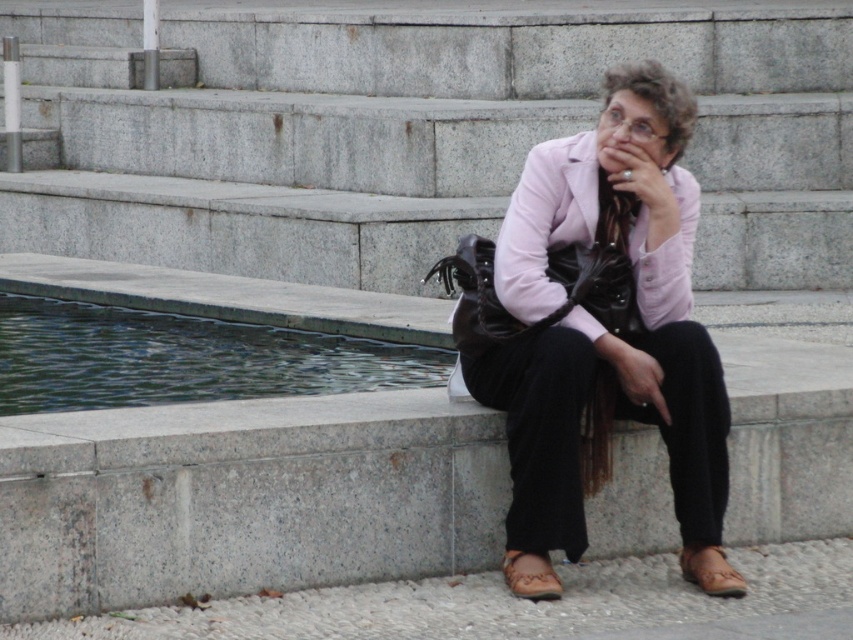
Can you confirm if green reflective water at lower left is smaller than brown leather sandal at lower right?

Incorrect, green reflective water at lower left is not smaller in size than brown leather sandal at lower right.

Describe the element at coordinates (184, 358) in the screenshot. This screenshot has height=640, width=853. I see `green reflective water at lower left` at that location.

The height and width of the screenshot is (640, 853). I want to click on green reflective water at lower left, so click(x=184, y=358).

Looking at this image, is brown leather sandal at lower right further to camera compared to brown leather sandal at lower center?

Yes, brown leather sandal at lower right is further from the viewer.

Does point (698, 548) lie behind point (547, 589)?

Yes, it is.

Where is `brown leather sandal at lower right`? brown leather sandal at lower right is located at coordinates (711, 572).

Is matte pink blazer at center smaller than green reflective water at lower left?

Indeed, matte pink blazer at center has a smaller size compared to green reflective water at lower left.

Does matte pink blazer at center have a greater height compared to green reflective water at lower left?

Yes, matte pink blazer at center is taller than green reflective water at lower left.

Is point (537, 184) farther from camera compared to point (136, 323)?

No.

Where is `matte pink blazer at center`? The height and width of the screenshot is (640, 853). matte pink blazer at center is located at coordinates (602, 324).